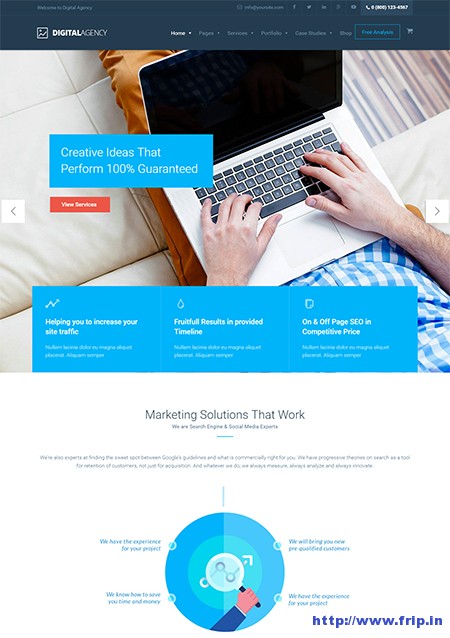
I want to click on crease in couch, so click(x=154, y=251).